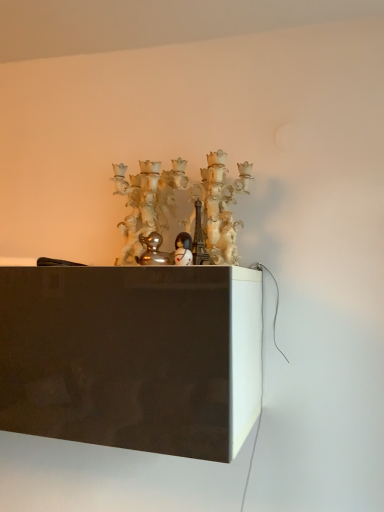
Question: Is shiny silver duckling at center, which is counted as the 1th toy, starting from the left, surrounded by translucent glass chandelier at center?

Choices:
 (A) yes
 (B) no

Answer: (B)

Question: Is translucent glass chandelier at center in front of shiny silver duckling at center, which is counted as the 1th toy, starting from the left?

Choices:
 (A) no
 (B) yes

Answer: (A)

Question: Is translucent glass chandelier at center positioned with its back to shiny silver duckling at center, which is counted as the 1th toy, starting from the left?

Choices:
 (A) yes
 (B) no

Answer: (B)

Question: Does translucent glass chandelier at center have a lesser height compared to shiny silver duckling at center, which is counted as the 1th toy, starting from the left?

Choices:
 (A) yes
 (B) no

Answer: (B)

Question: From the image's perspective, is translucent glass chandelier at center located beneath shiny silver duckling at center, placed as the second toy when sorted from right to left?

Choices:
 (A) yes
 (B) no

Answer: (B)

Question: Considering the positions of shiny silver duckling at center, placed as the second toy when sorted from right to left, and translucent glass chandelier at center in the image, is shiny silver duckling at center, placed as the second toy when sorted from right to left, taller or shorter than translucent glass chandelier at center?

Choices:
 (A) short
 (B) tall

Answer: (A)

Question: Based on their sizes in the image, would you say shiny silver duckling at center, which is counted as the 1th toy, starting from the left, is bigger or smaller than translucent glass chandelier at center?

Choices:
 (A) big
 (B) small

Answer: (B)

Question: Relative to translucent glass chandelier at center, is shiny silver duckling at center, placed as the second toy when sorted from right to left, in front or behind?

Choices:
 (A) behind
 (B) front

Answer: (B)

Question: Considering the positions of shiny silver duckling at center, placed as the second toy when sorted from right to left, and translucent glass chandelier at center in the image, is shiny silver duckling at center, placed as the second toy when sorted from right to left, wider or thinner than translucent glass chandelier at center?

Choices:
 (A) thin
 (B) wide

Answer: (A)

Question: In the image, is translucent glass chandelier at center positioned in front of or behind shiny silver duckling at center, placed as the second toy when sorted from right to left?

Choices:
 (A) behind
 (B) front

Answer: (A)

Question: Is translucent glass chandelier at center spatially inside shiny silver duckling at center, which is counted as the 1th toy, starting from the left, or outside of it?

Choices:
 (A) inside
 (B) outside

Answer: (B)

Question: Is point (134, 239) positioned closer to the camera than point (165, 252)?

Choices:
 (A) farther
 (B) closer

Answer: (A)

Question: Looking at their shapes, would you say translucent glass chandelier at center is wider or thinner than shiny silver duckling at center, placed as the second toy when sorted from right to left?

Choices:
 (A) wide
 (B) thin

Answer: (A)

Question: Does point (162, 264) appear closer or farther from the camera than point (183, 260)?

Choices:
 (A) closer
 (B) farther

Answer: (A)

Question: Is shiny silver duckling at center, which is counted as the 1th toy, starting from the left, situated inside white glossy figurine at center, which is the 1th toy in right-to-left order, or outside?

Choices:
 (A) outside
 (B) inside

Answer: (A)